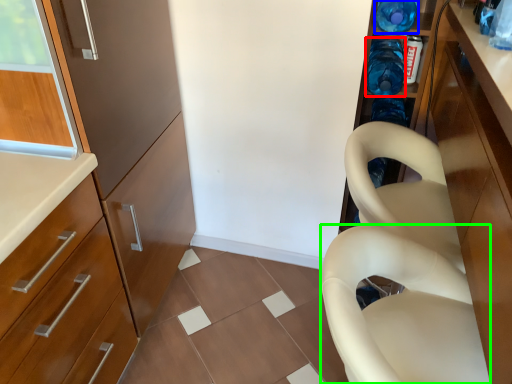
Question: Which object is the farthest from bottle (highlighted by a red box)? Choose among these: bottle (highlighted by a blue box) or feeding chair (highlighted by a green box).

Choices:
 (A) bottle
 (B) feeding chair

Answer: (B)